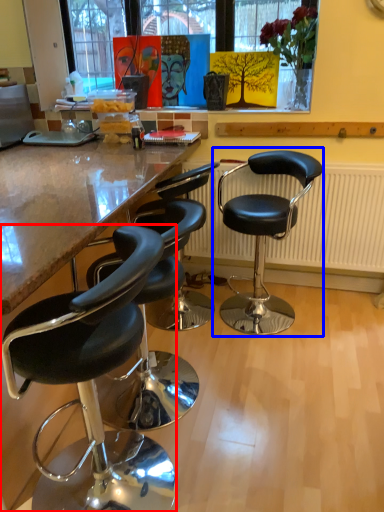
Question: Which point is further to the camera, chair (highlighted by a red box) or chair (highlighted by a blue box)?

Choices:
 (A) chair
 (B) chair

Answer: (B)